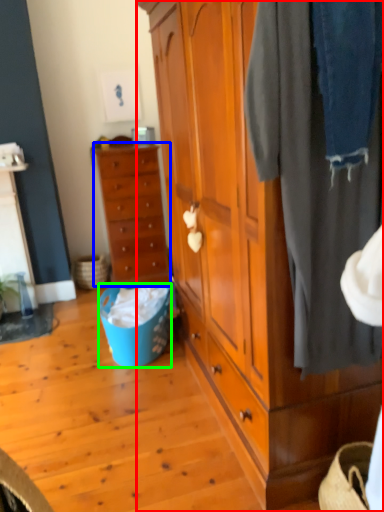
Question: Which object is positioned closest to cabinetry (highlighted by a red box)? Select from chest of drawers (highlighted by a blue box) and picnic basket (highlighted by a green box).

Choices:
 (A) chest of drawers
 (B) picnic basket

Answer: (B)